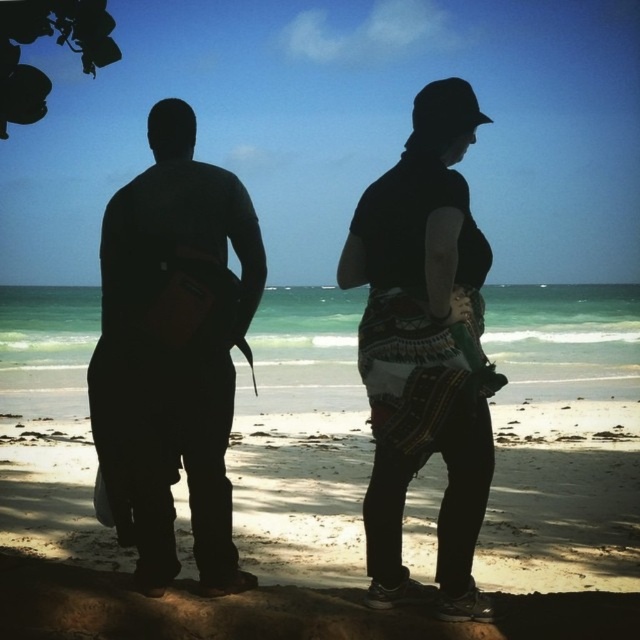
Can you confirm if black matte bag at left is shorter than black textured fabric skirt at center?

In fact, black matte bag at left may be taller than black textured fabric skirt at center.

Who is shorter, black matte bag at left or black textured fabric skirt at center?

With less height is black textured fabric skirt at center.

Does point (154, 316) come behind point (396, 198)?

Yes, point (154, 316) is farther from viewer.

Where is `black matte bag at left`? The height and width of the screenshot is (640, 640). black matte bag at left is located at coordinates (173, 352).

Does point (60, 515) come in front of point (156, 481)?

No, it is behind (156, 481).

Is smooth sand at center wider than black matte bag at left?

Yes, smooth sand at center is wider than black matte bag at left.

Who is more forward, [400,627] or [205,504]?

Point [400,627] is more forward.

The width and height of the screenshot is (640, 640). I want to click on smooth sand at center, so click(x=336, y=532).

Is silhouette fabric at center positioned before smooth sand at center?

No, silhouette fabric at center is behind smooth sand at center.

Between point (148, 435) and point (604, 552), which one is positioned behind?

Positioned behind is point (604, 552).

Does point (486, 612) come behind point (337, 477)?

No, (486, 612) is in front of (337, 477).

Identify the location of silhouette fabric at center. pos(173,352).